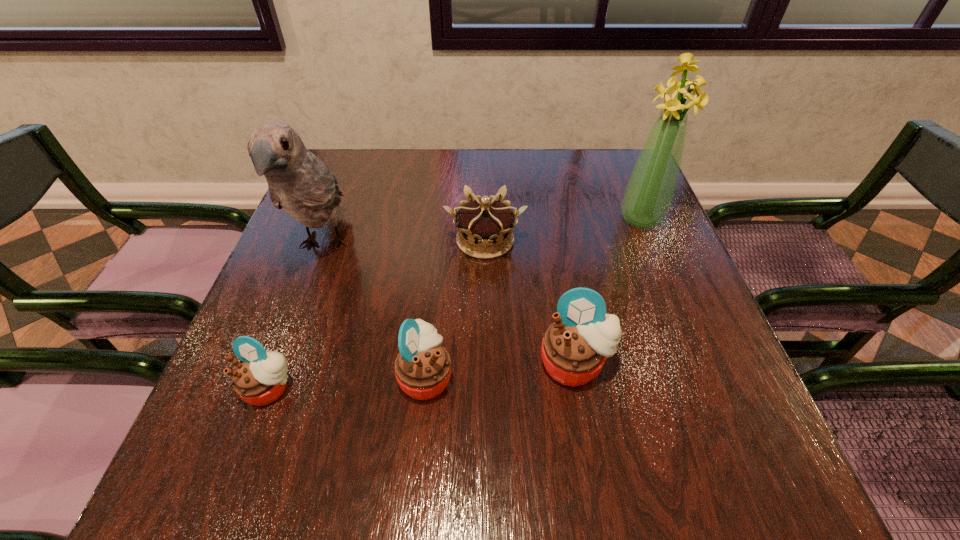
Where is `free space for a new muffin on the right`? Image resolution: width=960 pixels, height=540 pixels. free space for a new muffin on the right is located at coordinates (717, 353).